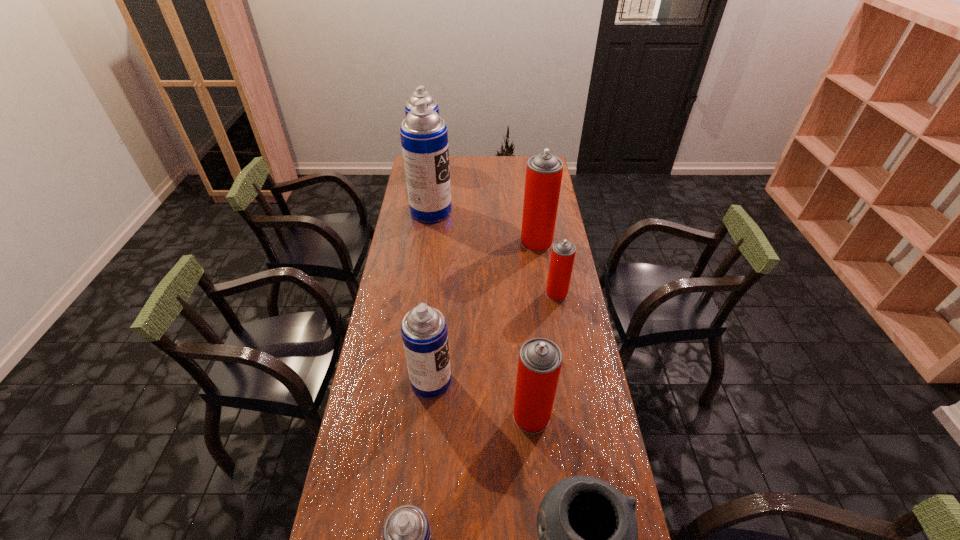
The image size is (960, 540). What are the coordinates of `the fourth farthest object` in the screenshot? It's located at (563, 252).

At what (x,y) coordinates should I click in order to perform the action: click on the second nearest red aerosol can. Please return your answer as a coordinate pair (x, y). The height and width of the screenshot is (540, 960). Looking at the image, I should click on (563, 252).

The width and height of the screenshot is (960, 540). I want to click on free spot located 0.310m on the label side of the third nearest blue aerosol can, so click(x=516, y=212).

This screenshot has width=960, height=540. What are the coordinates of `vacant space located on the label side of the farthest object` in the screenshot? It's located at (472, 170).

You are a GUI agent. You are given a task and a screenshot of the screen. Output one action in this format:
    pyautogui.click(x=<x>, y=<y>)
    Task: Click on the vacant area situated on the back of the sixth nearest object
    
    Given the screenshot: What is the action you would take?
    pyautogui.click(x=529, y=189)

This screenshot has height=540, width=960. Find the location of `blank space located 0.160m on the right of the nearest red aerosol can`. blank space located 0.160m on the right of the nearest red aerosol can is located at coordinates [602, 416].

At what (x,y) coordinates should I click in order to perform the action: click on vacant space positioned on the label side of the third nearest aerosol can. Please return your answer as a coordinate pair (x, y). Looking at the image, I should click on (500, 381).

You are a GUI agent. You are given a task and a screenshot of the screen. Output one action in this format:
    pyautogui.click(x=<x>, y=<y>)
    Task: Click on the free space located 0.270m on the back of the fourth farthest aerosol can
    This screenshot has height=540, width=960.
    Given the screenshot: What is the action you would take?
    pyautogui.click(x=547, y=243)

Locate an element on the screen. object at the far edge is located at coordinates (420, 93).

This screenshot has width=960, height=540. I want to click on object positioned at the far left corner, so click(x=420, y=93).